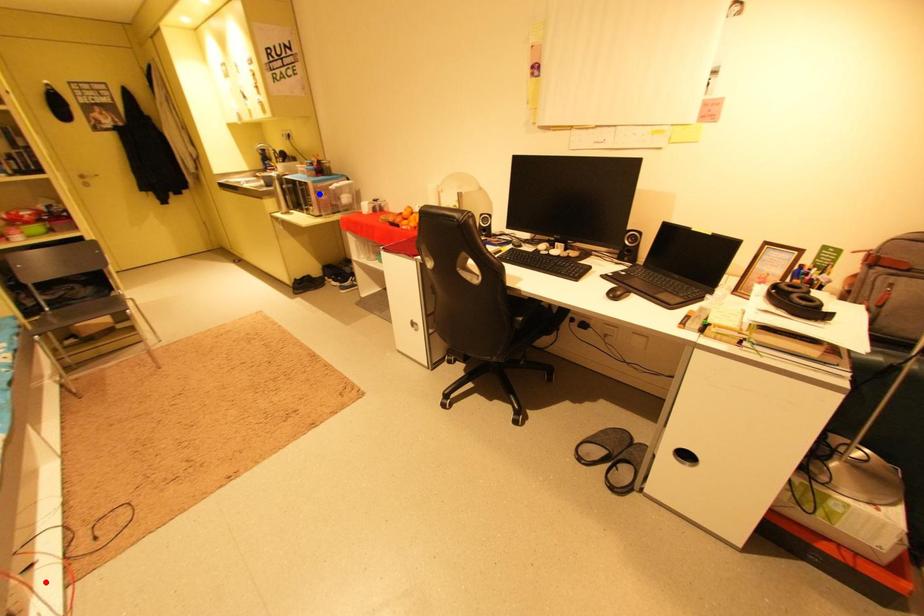
Question: Two points are marked on the image. Which point is closer to the camera?

Choices:
 (A) Blue point is closer.
 (B) Red point is closer.

Answer: (B)